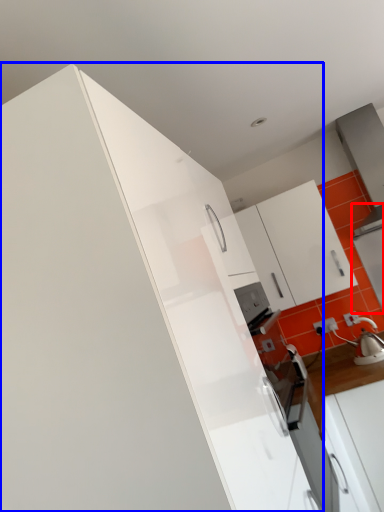
Question: Among these objects, which one is nearest to the camera, appliance (highlighted by a red box) or cabinetry (highlighted by a blue box)?

Choices:
 (A) appliance
 (B) cabinetry

Answer: (B)